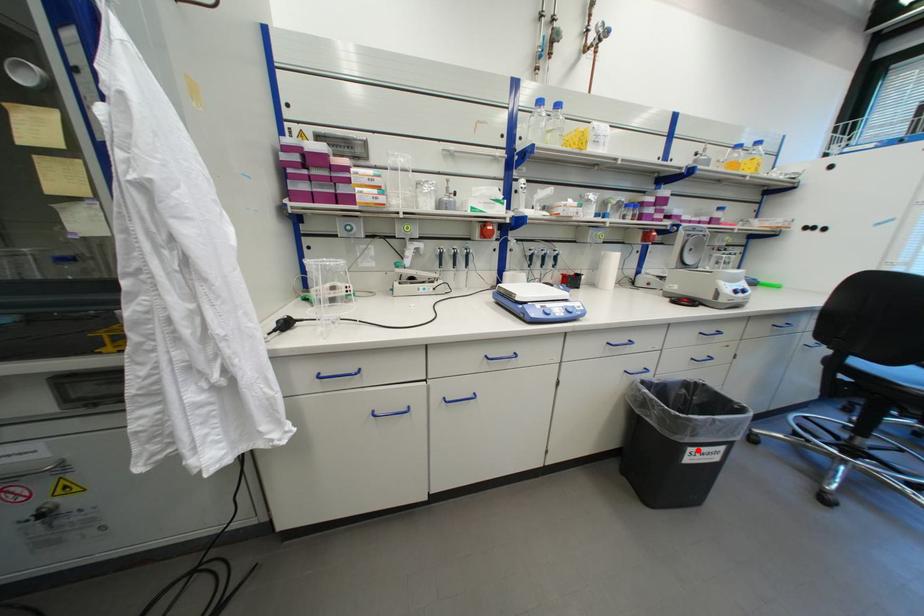
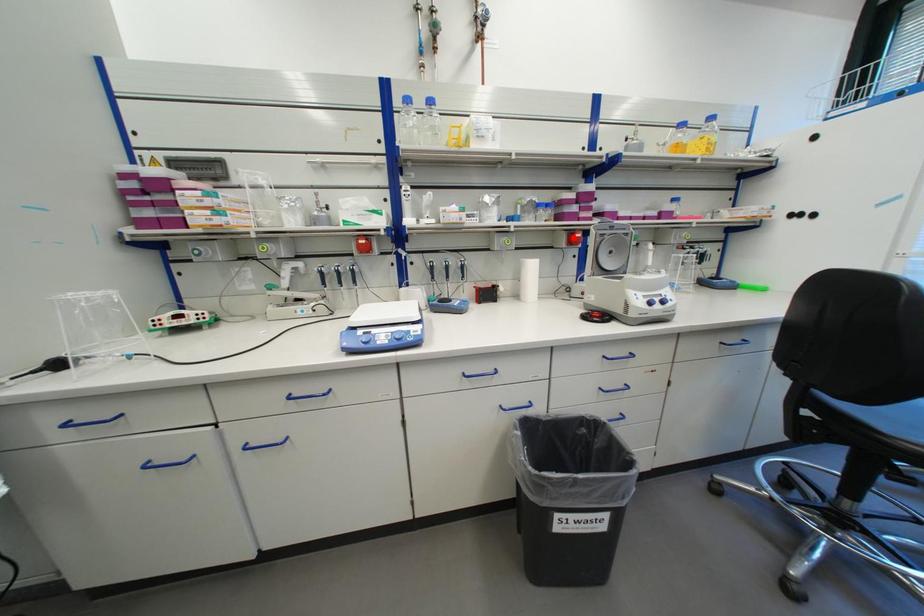
I am providing you with two images of the same scene from different viewpoints. A red point is marked on the first image and another point is marked on the second image. Does the point marked in image1 correspond to the same location as the one in image2?

No